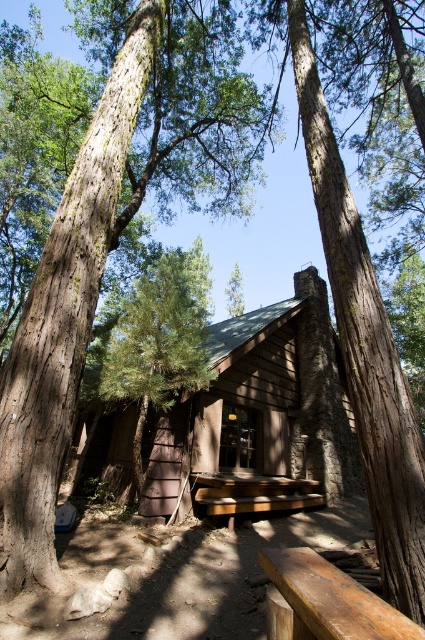
Is brown textured wood cabin at center bigger than wooden picnic table at center?

Correct, brown textured wood cabin at center is larger in size than wooden picnic table at center.

In the scene shown: Measure the distance between point (50, 330) and camera.

A distance of 13.48 feet exists between point (50, 330) and camera.

Find the location of a particular element. The width and height of the screenshot is (425, 640). brown textured wood cabin at center is located at coordinates (112, 232).

Is point (156, 513) more distant than point (251, 509)?

No, it is in front of (251, 509).

Where is `brown wooden cabin at center`? This screenshot has width=425, height=640. brown wooden cabin at center is located at coordinates (263, 404).

This screenshot has height=640, width=425. I want to click on brown wooden cabin at center, so click(x=263, y=404).

Is rustic wooden bench at center to the left of wooden picnic table at center from the viewer's perspective?

Indeed, rustic wooden bench at center is positioned on the left side of wooden picnic table at center.

Who is positioned more to the left, rustic wooden bench at center or wooden picnic table at center?

Positioned to the left is rustic wooden bench at center.

Looking at this image, who is more distant from viewer, [283,586] or [218,508]?

Point [218,508]

Where is `rustic wooden bench at center`? The height and width of the screenshot is (640, 425). rustic wooden bench at center is located at coordinates (333, 598).